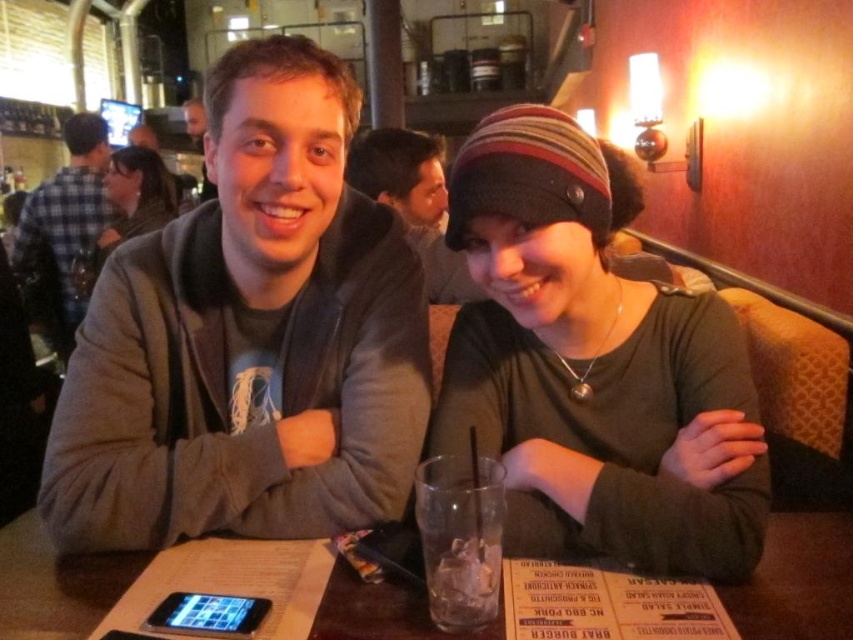
Question: Observing the image, what is the correct spatial positioning of knit cap at center in reference to plaid flannel shirt at upper left?

Choices:
 (A) right
 (B) left

Answer: (A)

Question: Does gray fleece jacket at center come behind black glossy smartphone at lower left?

Choices:
 (A) yes
 (B) no

Answer: (A)

Question: Which of the following is the closest to the observer?

Choices:
 (A) knit cap at center
 (B) brown paper menu at center

Answer: (B)

Question: Which object is the farthest from the knit cap at center?

Choices:
 (A) matte gray hoodie at center
 (B) matte gray hoodie at upper left

Answer: (A)

Question: Which point is farther from the camera taking this photo?

Choices:
 (A) (364, 625)
 (B) (164, 355)

Answer: (B)

Question: Is brown paper menu at center to the right of matte gray hoodie at center from the viewer's perspective?

Choices:
 (A) yes
 (B) no

Answer: (A)